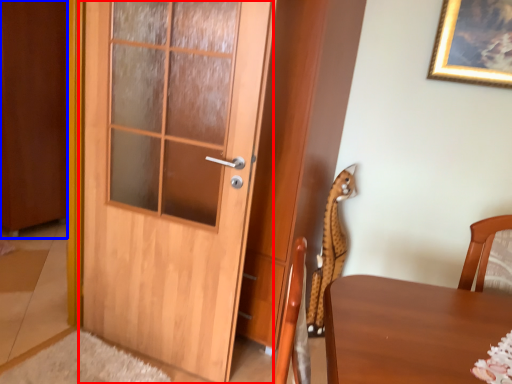
Question: Which of the following is the farthest to the observer, door (highlighted by a red box) or barn door (highlighted by a blue box)?

Choices:
 (A) door
 (B) barn door

Answer: (B)